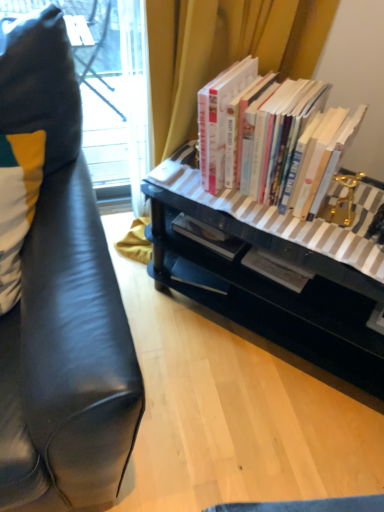
Question: Does white and yellow fabric pillow at left contain black glossy desk at center?

Choices:
 (A) no
 (B) yes

Answer: (A)

Question: From the image's perspective, is white and yellow fabric pillow at left below black glossy desk at center?

Choices:
 (A) no
 (B) yes

Answer: (A)

Question: Does white and yellow fabric pillow at left have a smaller size compared to black glossy desk at center?

Choices:
 (A) no
 (B) yes

Answer: (B)

Question: Can we say white and yellow fabric pillow at left lies outside black glossy desk at center?

Choices:
 (A) yes
 (B) no

Answer: (A)

Question: From a real-world perspective, is white and yellow fabric pillow at left below black glossy desk at center?

Choices:
 (A) yes
 (B) no

Answer: (B)

Question: Is white and yellow fabric pillow at left thinner than black glossy desk at center?

Choices:
 (A) yes
 (B) no

Answer: (A)

Question: Would you say hardcover books at center is a long distance from white and yellow fabric pillow at left?

Choices:
 (A) no
 (B) yes

Answer: (A)

Question: Is white and yellow fabric pillow at left completely or partially inside hardcover books at center?

Choices:
 (A) no
 (B) yes

Answer: (A)

Question: Is hardcover books at center in contact with white and yellow fabric pillow at left?

Choices:
 (A) no
 (B) yes

Answer: (A)

Question: Does hardcover books at center turn towards white and yellow fabric pillow at left?

Choices:
 (A) yes
 (B) no

Answer: (A)

Question: Is hardcover books at center further to the viewer compared to white and yellow fabric pillow at left?

Choices:
 (A) no
 (B) yes

Answer: (B)

Question: From the image's perspective, is hardcover books at center below white and yellow fabric pillow at left?

Choices:
 (A) no
 (B) yes

Answer: (A)

Question: Does hardcover books at center have a lesser height compared to black glossy desk at center?

Choices:
 (A) yes
 (B) no

Answer: (A)